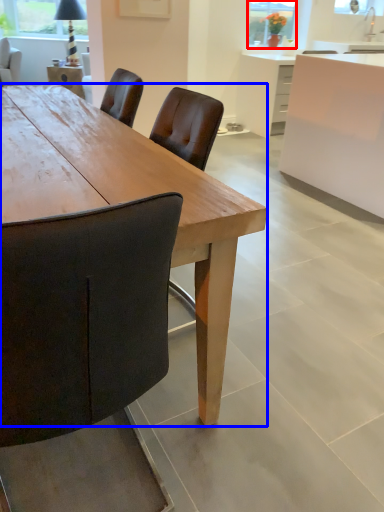
Question: Which of the following is the closest to the observer, window screen (highlighted by a red box) or desk (highlighted by a blue box)?

Choices:
 (A) window screen
 (B) desk

Answer: (B)